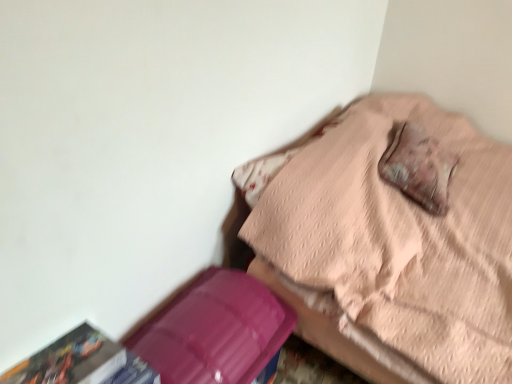
Question: From a real-world perspective, is leather-like brown pillow at upper right over purple plastic box at lower left?

Choices:
 (A) yes
 (B) no

Answer: (A)

Question: Is leather-like brown pillow at upper right next to purple plastic box at lower left?

Choices:
 (A) no
 (B) yes

Answer: (A)

Question: Is leather-like brown pillow at upper right positioned beyond the bounds of purple plastic box at lower left?

Choices:
 (A) no
 (B) yes

Answer: (B)

Question: Considering the relative positions of leather-like brown pillow at upper right and purple plastic box at lower left in the image provided, is leather-like brown pillow at upper right to the right of purple plastic box at lower left from the viewer's perspective?

Choices:
 (A) yes
 (B) no

Answer: (A)

Question: Does leather-like brown pillow at upper right lie behind purple plastic box at lower left?

Choices:
 (A) no
 (B) yes

Answer: (B)

Question: From the image's perspective, is leather-like brown pillow at upper right on purple plastic box at lower left?

Choices:
 (A) no
 (B) yes

Answer: (B)

Question: Is multicolored paper at lower left with purple plastic box at lower left?

Choices:
 (A) no
 (B) yes

Answer: (A)

Question: Does multicolored paper at lower left turn towards purple plastic box at lower left?

Choices:
 (A) no
 (B) yes

Answer: (A)

Question: Considering the relative sizes of multicolored paper at lower left and purple plastic box at lower left in the image provided, is multicolored paper at lower left thinner than purple plastic box at lower left?

Choices:
 (A) no
 (B) yes

Answer: (B)

Question: Is multicolored paper at lower left shorter than purple plastic box at lower left?

Choices:
 (A) no
 (B) yes

Answer: (B)

Question: Is multicolored paper at lower left to the left of purple plastic box at lower left from the viewer's perspective?

Choices:
 (A) no
 (B) yes

Answer: (B)

Question: Is multicolored paper at lower left turned away from purple plastic box at lower left?

Choices:
 (A) no
 (B) yes

Answer: (A)

Question: Is pink quilted bed at upper right facing away from multicolored paper at lower left?

Choices:
 (A) no
 (B) yes

Answer: (A)